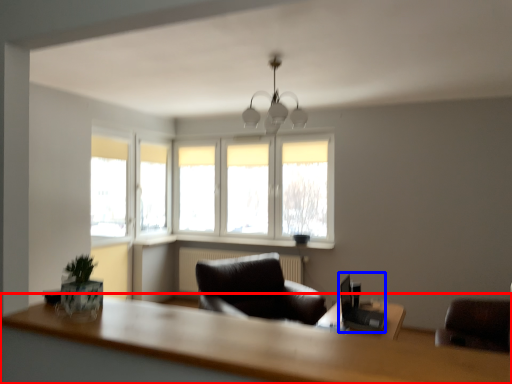
Question: Which object is closer to the camera taking this photo, table (highlighted by a red box) or computer desk (highlighted by a blue box)?

Choices:
 (A) table
 (B) computer desk

Answer: (A)